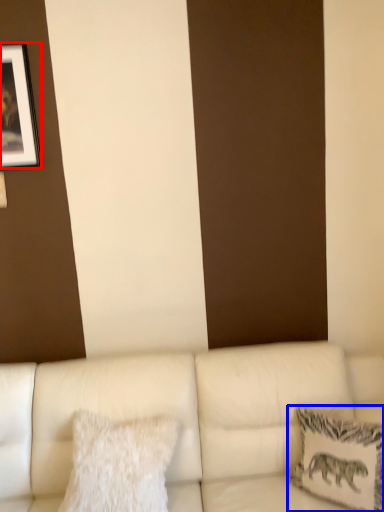
Question: Which of the following is the closest to the observer, picture frame (highlighted by a red box) or pillow (highlighted by a blue box)?

Choices:
 (A) picture frame
 (B) pillow

Answer: (B)